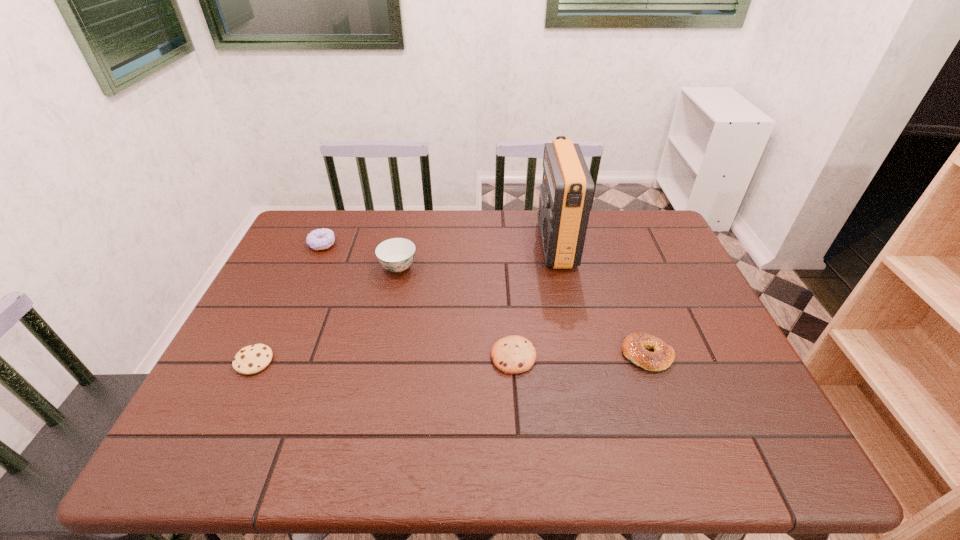
Where is `object that is at the right edge`? object that is at the right edge is located at coordinates (634, 347).

Find the location of a particular element. The image size is (960, 540). object located in the far left corner section of the desktop is located at coordinates (320, 239).

You are a GUI agent. You are given a task and a screenshot of the screen. Output one action in this format:
    pyautogui.click(x=<x>, y=<y>)
    Task: Click on the vacant space at the far edge of the desktop
    This screenshot has width=960, height=540.
    Given the screenshot: What is the action you would take?
    pyautogui.click(x=519, y=233)

The image size is (960, 540). I want to click on free space at the near edge, so click(415, 437).

The image size is (960, 540). I want to click on free spot at the right edge of the desktop, so click(701, 424).

You are a GUI agent. You are given a task and a screenshot of the screen. Output one action in this format:
    pyautogui.click(x=<x>, y=<y>)
    Task: Click on the free space at the far left corner
    
    Given the screenshot: What is the action you would take?
    pyautogui.click(x=343, y=222)

In the image, there is a desktop. At what (x,y) coordinates should I click in order to perform the action: click on vacant space at the near left corner. Please return your answer as a coordinate pair (x, y). The height and width of the screenshot is (540, 960). Looking at the image, I should click on (233, 465).

This screenshot has width=960, height=540. I want to click on free space between the doughnut and the radio receiver, so click(x=439, y=244).

What are the coordinates of `vacant area that lies between the fifth shortest object and the doughnut` in the screenshot? It's located at (360, 255).

Locate an element on the screen. vacant point located between the left cookie and the right cookie is located at coordinates (384, 359).